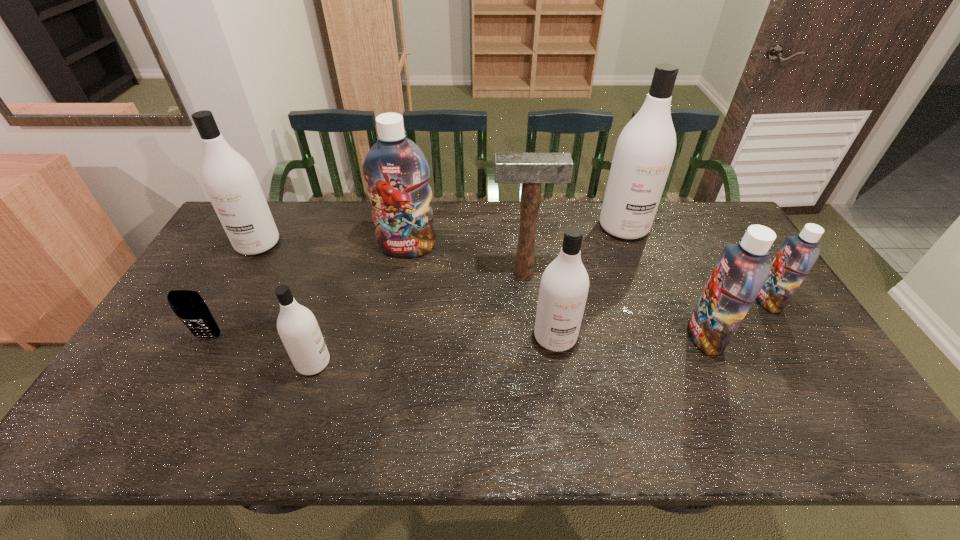
Locate an element on the screen. The width and height of the screenshot is (960, 540). object that is at the right edge is located at coordinates (798, 254).

Identify the location of object present at the far left corner. The width and height of the screenshot is (960, 540). (229, 180).

You are a GUI agent. You are given a task and a screenshot of the screen. Output one action in this format:
    pyautogui.click(x=<x>, y=<y>)
    Task: Click on the vacant position at the far edge of the desktop
    
    Given the screenshot: What is the action you would take?
    pyautogui.click(x=327, y=209)

In the image, there is a desktop. Where is `free space at the left edge`? This screenshot has width=960, height=540. free space at the left edge is located at coordinates (173, 359).

This screenshot has width=960, height=540. In the image, there is a desktop. What are the coordinates of `vacant space at the right edge` in the screenshot? It's located at (763, 337).

Identify the location of vacant space at the far right corner of the desktop. The image size is (960, 540). (697, 210).

The height and width of the screenshot is (540, 960). What are the coordinates of `free spot between the mallet and the rightmost object` in the screenshot? It's located at (645, 288).

Find the location of a particular element. vacant point located between the biggest white shampoo and the rightmost object is located at coordinates (696, 264).

Find the location of a particular element. The height and width of the screenshot is (540, 960). vacant area that lies between the sixth shampoo from right to left and the shortest object is located at coordinates (261, 350).

You are a GUI agent. You are given a task and a screenshot of the screen. Output one action in this format:
    pyautogui.click(x=<x>, y=<y>)
    Task: Click on the vacant point located between the smallest white shampoo and the tallest object
    The image size is (960, 540).
    Given the screenshot: What is the action you would take?
    pyautogui.click(x=468, y=295)